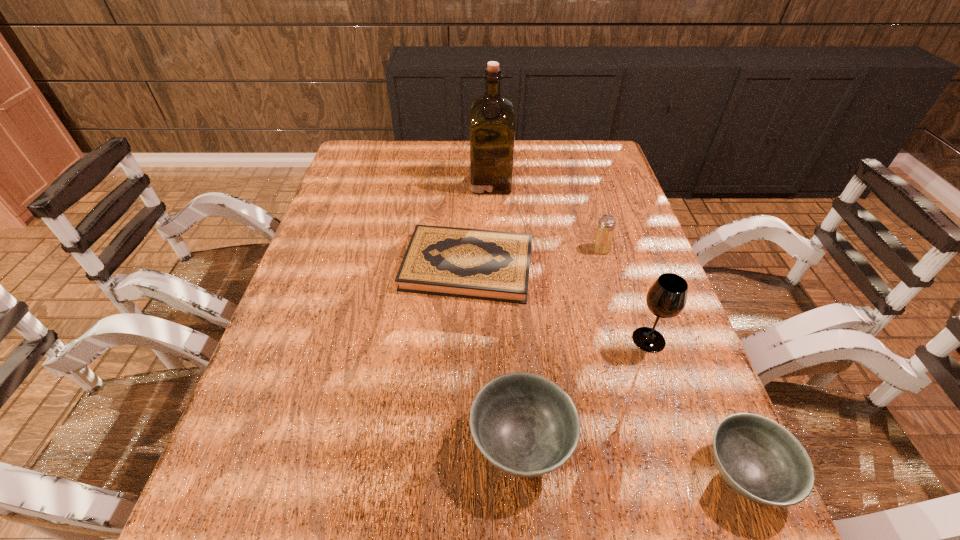
At what (x,y) coordinates should I click in order to perform the action: click on vacant region located on the back of the left bowl. Please return your answer as a coordinate pair (x, y). Looking at the image, I should click on (513, 307).

At what (x,y) coordinates should I click in order to perform the action: click on vacant space situated 0.310m on the back of the shorter bowl. Please return your answer as a coordinate pair (x, y). The height and width of the screenshot is (540, 960). Looking at the image, I should click on (675, 305).

Where is `free location located 0.290m on the label of the farthest object`? free location located 0.290m on the label of the farthest object is located at coordinates (379, 183).

Locate an element on the screen. vacant space located on the label of the farthest object is located at coordinates (411, 183).

Locate an element on the screen. The width and height of the screenshot is (960, 540). vacant space located 0.400m on the label of the farthest object is located at coordinates (345, 183).

Locate an element on the screen. vacant space located on the left of the wineglass is located at coordinates (526, 340).

This screenshot has width=960, height=540. In order to click on free space located on the back of the shortest object in this screenshot , I will do `click(470, 172)`.

I want to click on vacant point located 0.130m on the back of the saltshaker, so click(x=590, y=213).

Where is `object at the far edge`? Image resolution: width=960 pixels, height=540 pixels. object at the far edge is located at coordinates (492, 117).

Where is `bowl present at the right edge`? The width and height of the screenshot is (960, 540). bowl present at the right edge is located at coordinates (758, 458).